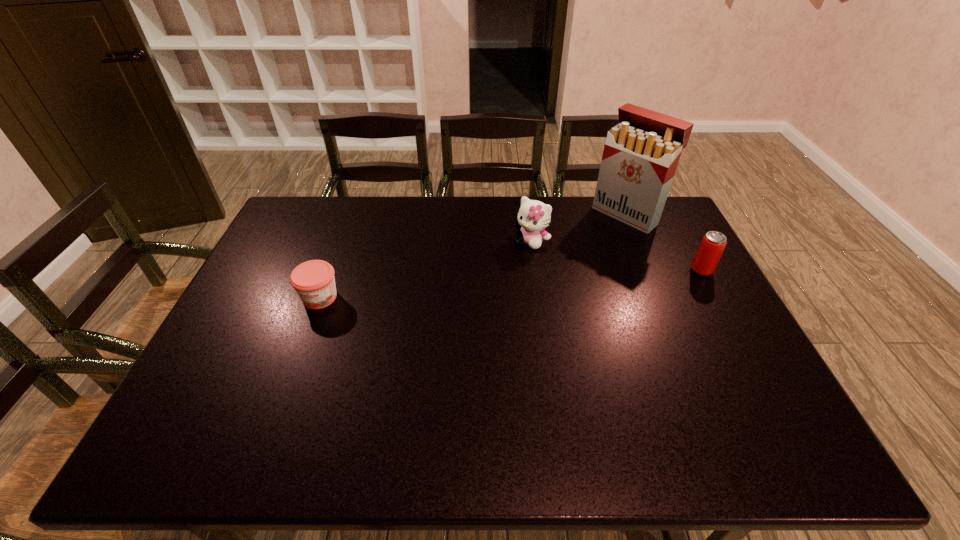
Find the location of `free spot located on the front-facing side of the third object from right to left`. free spot located on the front-facing side of the third object from right to left is located at coordinates (456, 320).

The height and width of the screenshot is (540, 960). In order to click on free point located on the front-facing side of the third object from right to left in this screenshot , I will do `click(502, 271)`.

Locate an element on the screen. vacant area situated 0.290m on the front-facing side of the third object from right to left is located at coordinates (472, 302).

Locate an element on the screen. free space located 0.100m with the lid open on the cigarette case is located at coordinates (592, 241).

The image size is (960, 540). Find the location of `vacant space located 0.380m with the lid open on the cigarette case`. vacant space located 0.380m with the lid open on the cigarette case is located at coordinates (540, 282).

You are a GUI agent. You are given a task and a screenshot of the screen. Output one action in this format:
    pyautogui.click(x=<x>, y=<y>)
    Task: Click on the vacant space located 0.400m with the lid open on the cigarette case
    Image resolution: width=960 pixels, height=540 pixels.
    Given the screenshot: What is the action you would take?
    pyautogui.click(x=536, y=286)

Identify the location of kitten present at the far edge. (534, 216).

This screenshot has height=540, width=960. Find the location of `cigarette case present at the far edge`. cigarette case present at the far edge is located at coordinates (641, 154).

The height and width of the screenshot is (540, 960). What are the coordinates of `beer can that is at the right edge` in the screenshot? It's located at (710, 250).

In order to click on cigarette case located in the right edge section of the desktop in this screenshot , I will do `click(641, 154)`.